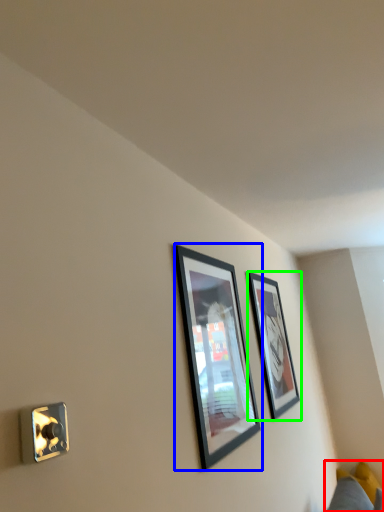
Question: Estimate the real-world distances between objects in this image. Which object is farther from couch (highlighted by a red box), picture frame (highlighted by a blue box) or picture frame (highlighted by a green box)?

Choices:
 (A) picture frame
 (B) picture frame

Answer: (A)